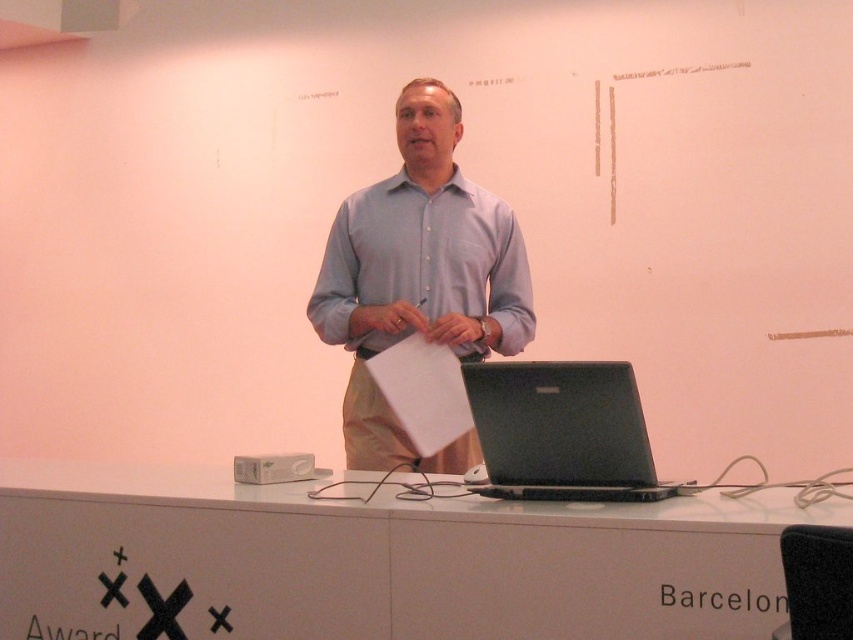
Does white glossy table at center appear on the left side of black matte laptop at center?

Yes, white glossy table at center is to the left of black matte laptop at center.

Who is lower down, white glossy table at center or black matte laptop at center?

white glossy table at center

Where is `white glossy table at center`? The width and height of the screenshot is (853, 640). white glossy table at center is located at coordinates (376, 561).

Can you confirm if white glossy table at center is thinner than light blue shirt at center?

No, white glossy table at center is not thinner than light blue shirt at center.

Who is more forward, (635, 544) or (357, 304)?

Positioned in front is point (635, 544).

Locate an element on the screen. white glossy table at center is located at coordinates click(376, 561).

Who is positioned more to the right, light blue shirt at center or black matte laptop at center?

Positioned to the right is black matte laptop at center.

Is light blue shirt at center above black matte laptop at center?

Yes.

Find the location of a particular element. This screenshot has height=640, width=853. light blue shirt at center is located at coordinates (419, 276).